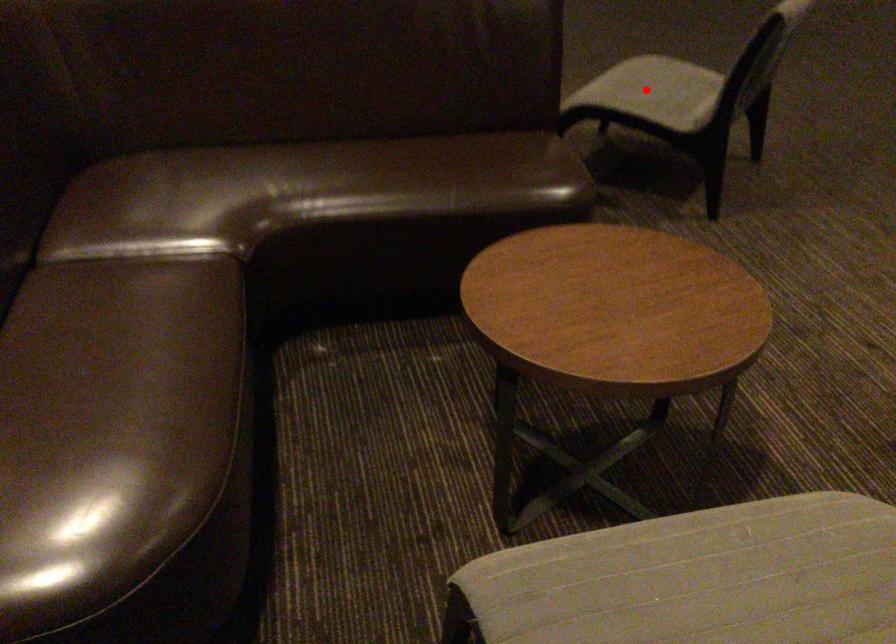
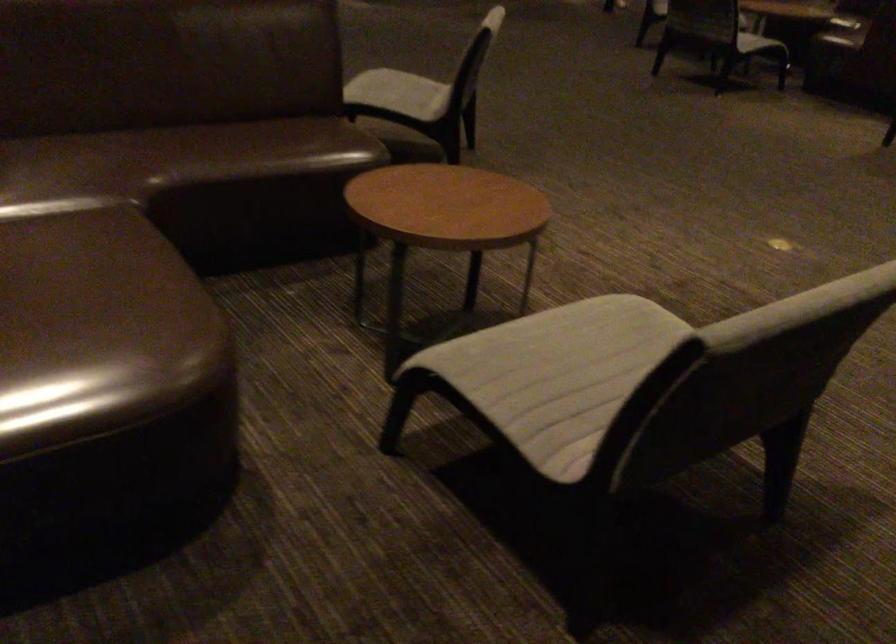
Where in the second image is the point corresponding to the highlighted location from the first image?

(399, 93)